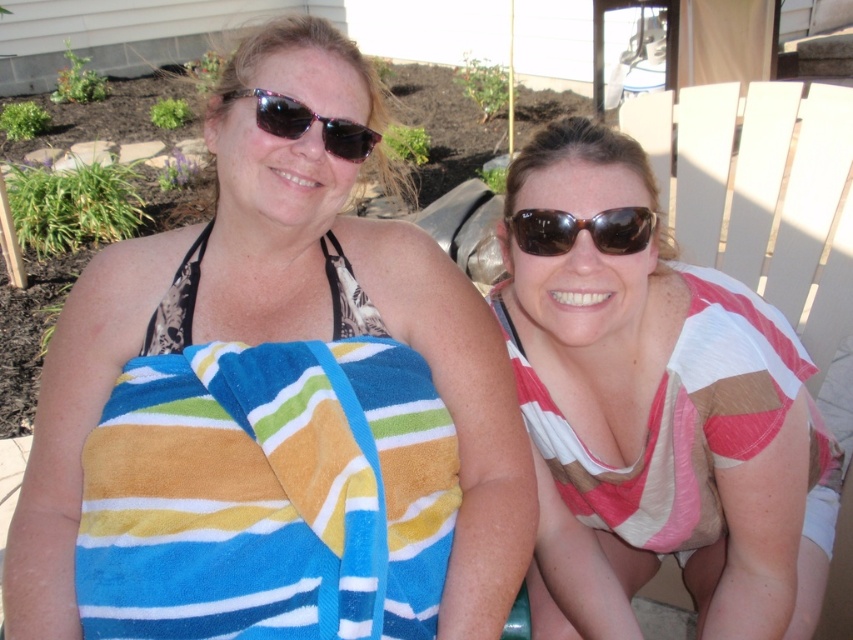
Question: Is striped cotton beach towel at left thinner than brown matte sunglasses at center?

Choices:
 (A) yes
 (B) no

Answer: (B)

Question: Which point appears closest to the camera in this image?

Choices:
 (A) (231, 584)
 (B) (302, 28)
 (C) (190, 259)

Answer: (A)

Question: From the image, what is the correct spatial relationship of striped towel at left in relation to black printed bikini top at left?

Choices:
 (A) above
 (B) below

Answer: (B)

Question: Does striped fabric shirt at right lie behind matte black sunglasses at upper center?

Choices:
 (A) yes
 (B) no

Answer: (B)

Question: Which point appears farthest from the camera in this image?

Choices:
 (A) (376, 88)
 (B) (149, 346)

Answer: (A)

Question: Which object is farther from the camera taking this photo?

Choices:
 (A) striped cotton beach towel at left
 (B) matte black sunglasses at upper center
 (C) brown matte sunglasses at center

Answer: (B)